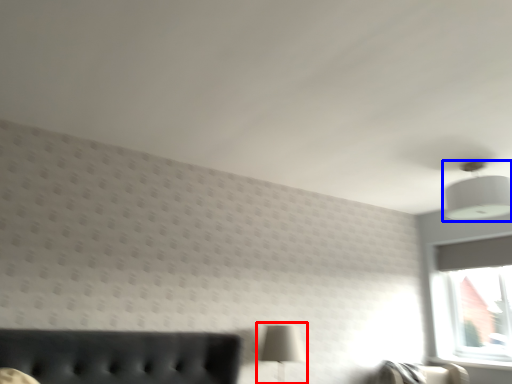
Question: Which object is further to the camera taking this photo, table lamp (highlighted by a red box) or lamp (highlighted by a blue box)?

Choices:
 (A) table lamp
 (B) lamp

Answer: (A)